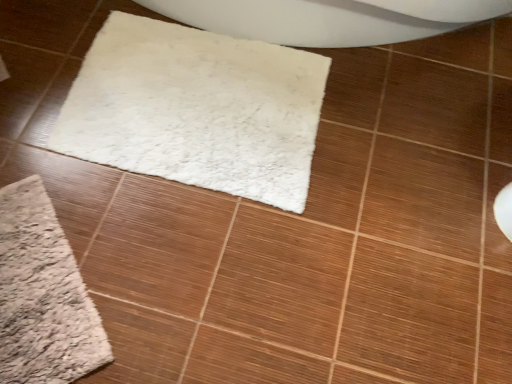
Locate an element on the screen. This screenshot has height=384, width=512. free space behind beige fuzzy bath mat at lower left is located at coordinates (67, 170).